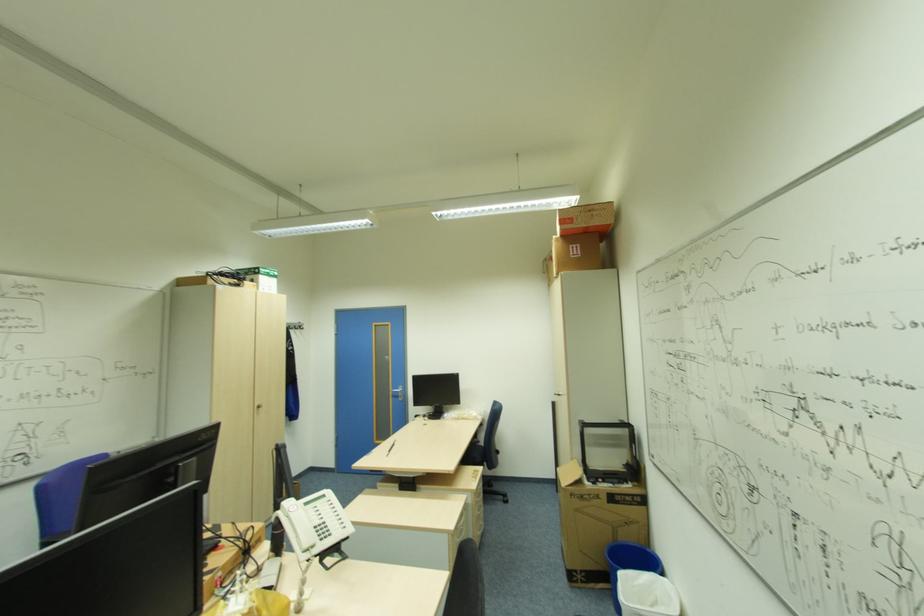
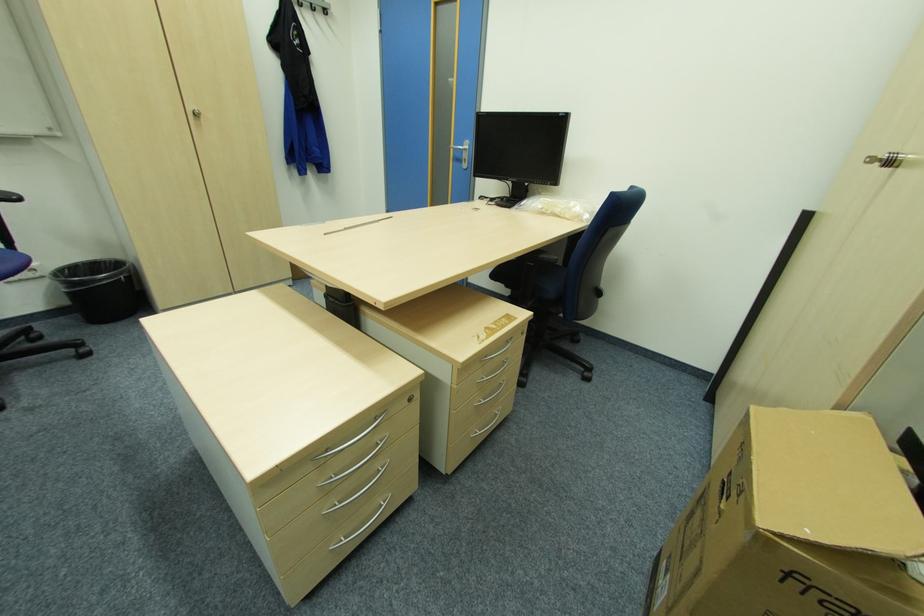
In the second image, find the point that corresponds to (403,391) in the first image.

(468, 148)